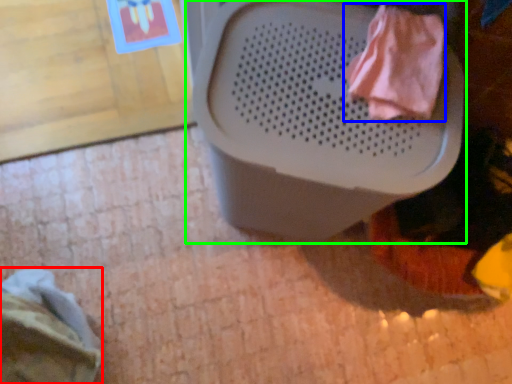
Question: Estimate the real-world distances between objects in this image. Which object is closer to clothing (highlighted by a red box), clothing (highlighted by a blue box) or waste container (highlighted by a green box)?

Choices:
 (A) clothing
 (B) waste container

Answer: (B)